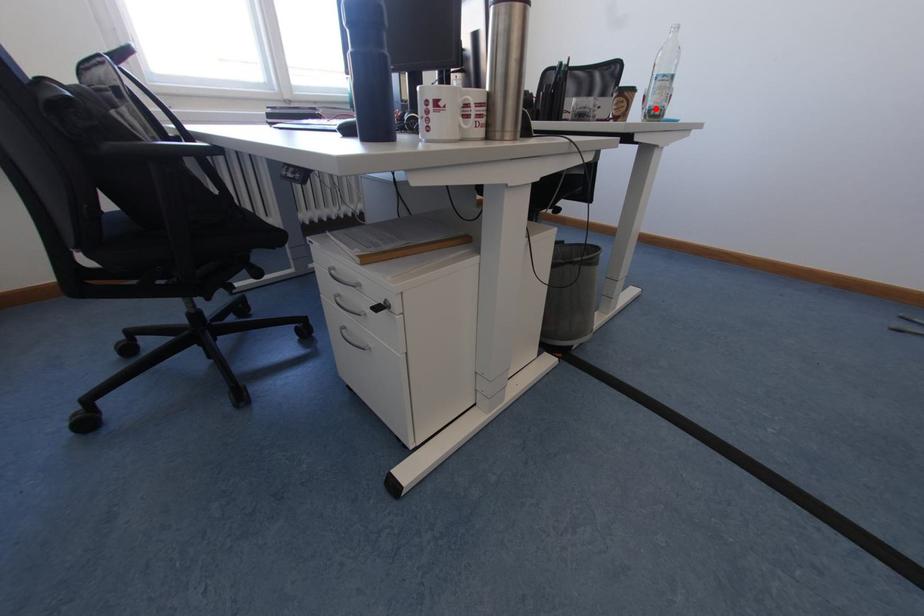
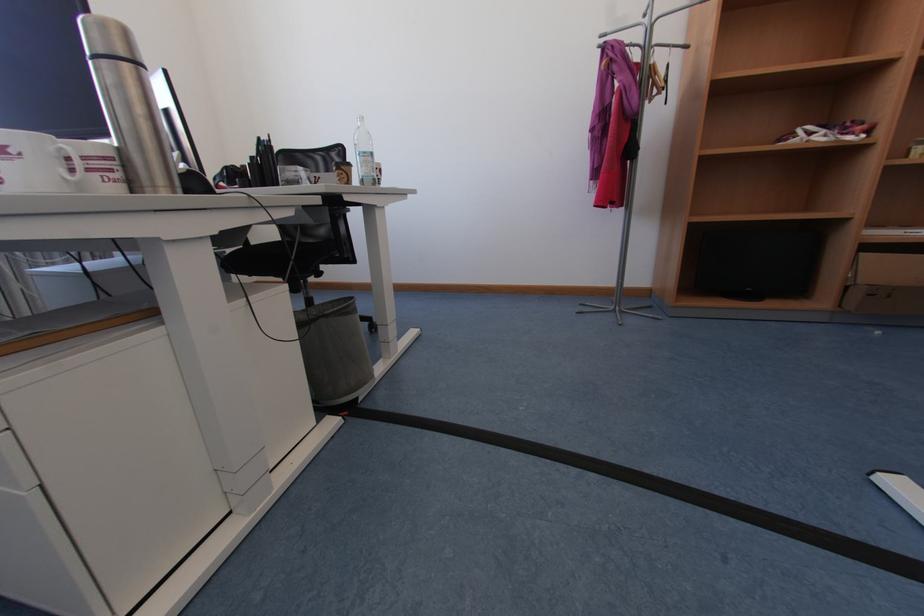
Question: A red point is marked in image1. In image2, is the corresponding 3D point closer to the camera or farther? Reply with the corresponding letter.

Choices:
 (A) The corresponding 3D point is closer.
 (B) The corresponding 3D point is farther.

Answer: (A)